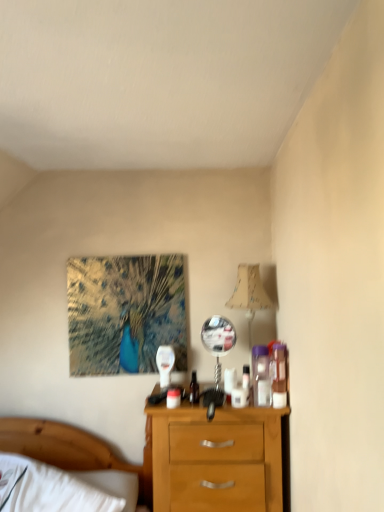
Question: From their relative heights in the image, would you say beige fabric lampshade at upper right is taller or shorter than white wood bed at lower left?

Choices:
 (A) tall
 (B) short

Answer: (A)

Question: Does point (236, 287) appear closer or farther from the camera than point (127, 461)?

Choices:
 (A) closer
 (B) farther

Answer: (B)

Question: Considering the real-world distances, which object is farthest from the beige fabric lampshade at upper right?

Choices:
 (A) white wood bed at lower left
 (B) translucent plastic container at right, which appears as the first toiletry when viewed from the right
 (C) translucent plastic container at right, arranged as the second toiletry when viewed from the right
 (D) matte plastic bottle at center

Answer: (A)

Question: Estimate the real-world distances between objects in this image. Which object is closer to the matte plastic bottle at center?

Choices:
 (A) beige fabric lampshade at upper right
 (B) white wood bed at lower left
 (C) translucent plastic container at right, arranged as the second toiletry when viewed from the right
 (D) translucent plastic container at right, which appears as the first toiletry when viewed from the right

Answer: (C)